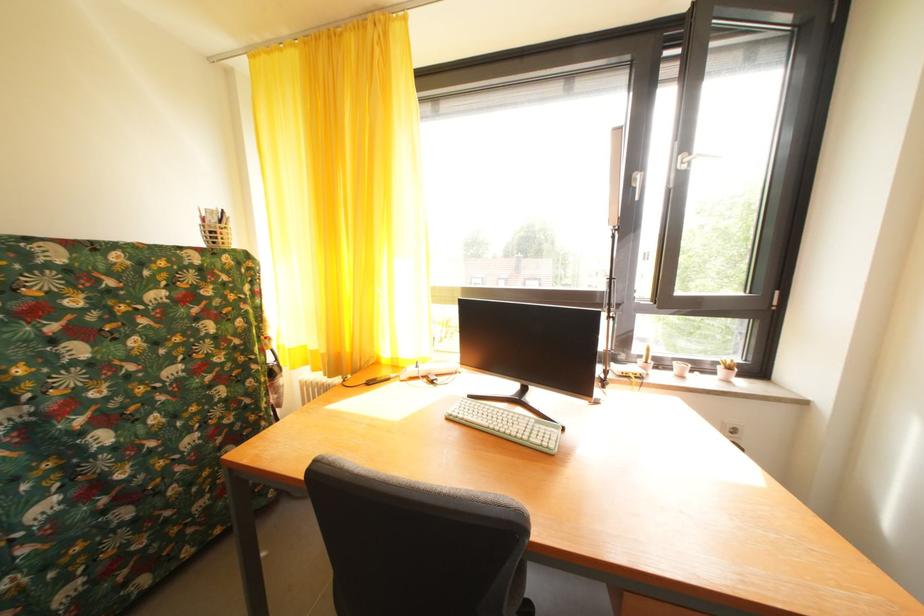
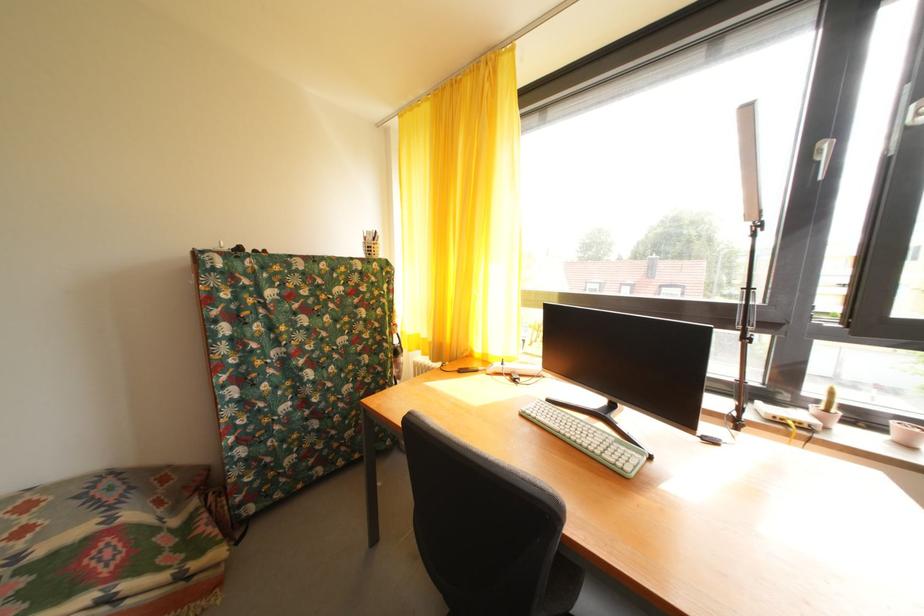
The point at [685,370] is marked in the first image. Where is the corresponding point in the second image?

(904, 430)